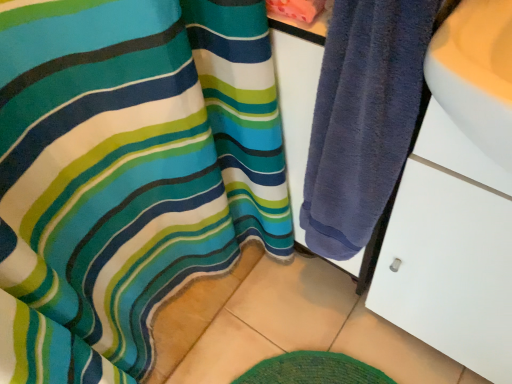
Question: Is white matte drawer at right at the back of dark blue towel at right?

Choices:
 (A) yes
 (B) no

Answer: (B)

Question: From the image's perspective, is dark blue towel at right beneath white matte drawer at right?

Choices:
 (A) yes
 (B) no

Answer: (B)

Question: Does dark blue towel at right have a lesser width compared to white matte drawer at right?

Choices:
 (A) no
 (B) yes

Answer: (B)

Question: Considering the relative sizes of dark blue towel at right and white matte drawer at right in the image provided, is dark blue towel at right shorter than white matte drawer at right?

Choices:
 (A) no
 (B) yes

Answer: (B)

Question: Is dark blue towel at right closer to the viewer compared to white matte drawer at right?

Choices:
 (A) yes
 (B) no

Answer: (B)

Question: Is dark blue towel at right outside white matte drawer at right?

Choices:
 (A) yes
 (B) no

Answer: (A)

Question: Is white matte drawer at right behind dark blue towel at right?

Choices:
 (A) yes
 (B) no

Answer: (B)

Question: From the image's perspective, is white matte drawer at right on dark blue towel at right?

Choices:
 (A) no
 (B) yes

Answer: (A)

Question: Considering the relative sizes of white matte drawer at right and dark blue towel at right in the image provided, is white matte drawer at right bigger than dark blue towel at right?

Choices:
 (A) yes
 (B) no

Answer: (A)

Question: From a real-world perspective, is white matte drawer at right located beneath dark blue towel at right?

Choices:
 (A) yes
 (B) no

Answer: (A)

Question: Is white matte drawer at right completely or partially outside of dark blue towel at right?

Choices:
 (A) yes
 (B) no

Answer: (A)

Question: From a real-world perspective, does white matte drawer at right stand above dark blue towel at right?

Choices:
 (A) no
 (B) yes

Answer: (A)

Question: Is white matte drawer at right to the left or to the right of dark blue towel at right in the image?

Choices:
 (A) right
 (B) left

Answer: (A)